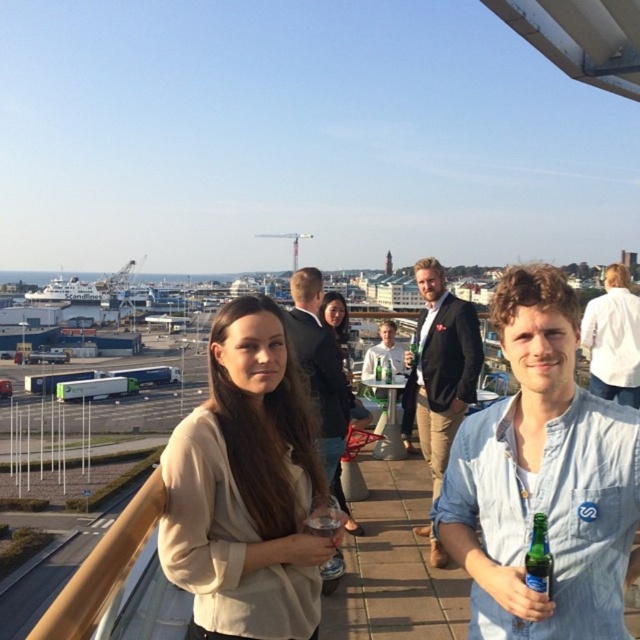
Can you confirm if light blue denim shirt at center is positioned above matte beige blouse at center?

No, light blue denim shirt at center is not above matte beige blouse at center.

Who is more distant from viewer, (x=628, y=449) or (x=550, y=353)?

Point (x=550, y=353)

Locate an element on the screen. light blue denim shirt at center is located at coordinates (544, 480).

Based on the photo, is matte beige blouse at center to the left of beige fabric shirt at center from the viewer's perspective?

Incorrect, matte beige blouse at center is not on the left side of beige fabric shirt at center.

Where is `matte beige blouse at center`? Image resolution: width=640 pixels, height=640 pixels. matte beige blouse at center is located at coordinates (544, 477).

Measure the distance between white cotton shirt at upper right and camera.

white cotton shirt at upper right and camera are 135.38 feet apart from each other.

Is white cotton shirt at upper right smaller than translucent plastic cup at center?

No, white cotton shirt at upper right is not smaller than translucent plastic cup at center.

What do you see at coordinates (612, 339) in the screenshot?
I see `white cotton shirt at upper right` at bounding box center [612, 339].

Locate an element on the screen. Image resolution: width=640 pixels, height=640 pixels. white cotton shirt at upper right is located at coordinates (612, 339).